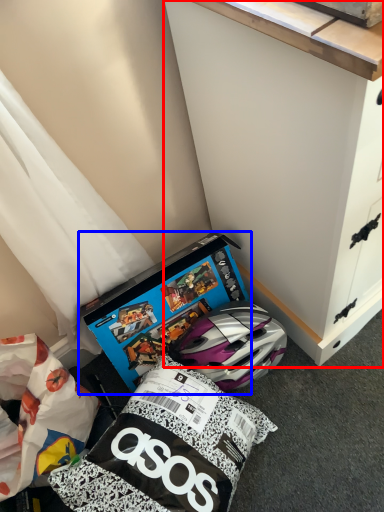
Question: Which point is further to the camera, cabinetry (highlighted by a red box) or box (highlighted by a blue box)?

Choices:
 (A) cabinetry
 (B) box

Answer: (B)